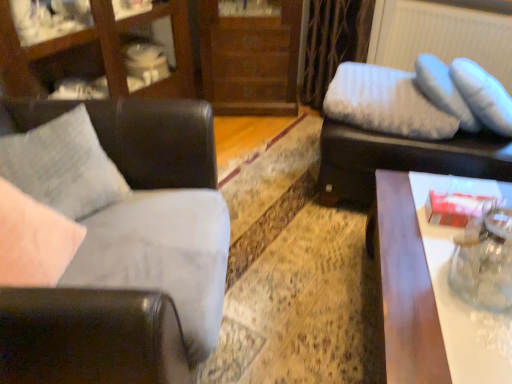
Measure the distance between textured gray pillow at left, the first pillow positioned from the left, and camera.

textured gray pillow at left, the first pillow positioned from the left, and camera are 4.03 feet apart.

Locate an element on the screen. Image resolution: width=512 pixels, height=384 pixels. textured gray pillow at left, the first pillow positioned from the left is located at coordinates (63, 166).

At what (x,y) coordinates should I click in order to perform the action: click on leather couch at left. Please return your answer as a coordinate pair (x, y). The width and height of the screenshot is (512, 384). Looking at the image, I should click on point(116,256).

Describe the element at coordinates (432, 292) in the screenshot. This screenshot has width=512, height=384. I see `white glossy table at right` at that location.

What do you see at coordinates (404, 158) in the screenshot? I see `matte black swivel chair at upper right` at bounding box center [404, 158].

The image size is (512, 384). What do you see at coordinates (250, 60) in the screenshot?
I see `wooden dresser at center` at bounding box center [250, 60].

Where is `white fabric radiator at upper right`? This screenshot has width=512, height=384. white fabric radiator at upper right is located at coordinates (442, 36).

Locate an element on the screen. matte wood entertainment center at upper left is located at coordinates (101, 51).

Identify the location of textured gray pillow at left, marked as the 1th pillow in a front-to-back arrangement. (63, 166).

Which is in front, matte black swivel chair at upper right or white fluffy pillow at upper right, which ranks as the 2th pillow in front-to-back order?

Positioned in front is matte black swivel chair at upper right.

From a real-world perspective, which object stands above the other?

In real-world perspective, white fluffy pillow at upper right, arranged as the first pillow when viewed from the right, is above.

From the image's perspective, between matte black swivel chair at upper right and white fluffy pillow at upper right, the second pillow when ordered from left to right, which one is located above?

white fluffy pillow at upper right, the second pillow when ordered from left to right.

Based on the photo, how far apart are matte black swivel chair at upper right and white fluffy pillow at upper right, arranged as the first pillow when viewed from the right?

matte black swivel chair at upper right is 4.41 inches away from white fluffy pillow at upper right, arranged as the first pillow when viewed from the right.

Is textured gray pillow at left, which is the 2th pillow in right-to-left order, with white fluffy pillow at upper right, marked as the 1th pillow in a back-to-front arrangement?

textured gray pillow at left, which is the 2th pillow in right-to-left order, and white fluffy pillow at upper right, marked as the 1th pillow in a back-to-front arrangement, are clearly separated.

Can you confirm if textured gray pillow at left, the first pillow positioned from the left, is shorter than white fluffy pillow at upper right, the second pillow when ordered from left to right?

No.

Which point is more distant from viewer, (x=115, y=186) or (x=381, y=128)?

Point (x=381, y=128)

Is textured gray pillow at left, acting as the 2th pillow starting from the back, at the left side of white fluffy pillow at upper right, which ranks as the 2th pillow in front-to-back order?

Yes, textured gray pillow at left, acting as the 2th pillow starting from the back, is to the left of white fluffy pillow at upper right, which ranks as the 2th pillow in front-to-back order.

Does white fabric radiator at upper right appear on the left side of white fluffy pillow at upper right, the second pillow when ordered from left to right?

No.

From a real-world perspective, is white fabric radiator at upper right above or below white fluffy pillow at upper right, marked as the 1th pillow in a back-to-front arrangement?

From a real-world perspective, white fabric radiator at upper right is physically above white fluffy pillow at upper right, marked as the 1th pillow in a back-to-front arrangement.

Could you tell me if white fabric radiator at upper right is facing white fluffy pillow at upper right, which ranks as the 2th pillow in front-to-back order?

Yes, white fabric radiator at upper right is turned towards white fluffy pillow at upper right, which ranks as the 2th pillow in front-to-back order.

Is white fabric radiator at upper right positioned far away from white fluffy pillow at upper right, marked as the 1th pillow in a back-to-front arrangement?

No, there isn't a large distance between white fabric radiator at upper right and white fluffy pillow at upper right, marked as the 1th pillow in a back-to-front arrangement.

Are matte black swivel chair at upper right and wooden dresser at center far apart?

Yes, matte black swivel chair at upper right is far from wooden dresser at center.

Identify the location of dresser lying behind the matte black swivel chair at upper right. The image size is (512, 384). click(x=250, y=60).

From a real-world perspective, which is physically below, matte black swivel chair at upper right or wooden dresser at center?

matte black swivel chair at upper right is physically lower.

From the image's perspective, is white fluffy pillow at upper right, marked as the 1th pillow in a back-to-front arrangement, located above or below matte black swivel chair at upper right?

Based on their image positions, white fluffy pillow at upper right, marked as the 1th pillow in a back-to-front arrangement, is located above matte black swivel chair at upper right.

Would you say white fluffy pillow at upper right, marked as the 1th pillow in a back-to-front arrangement, is outside matte black swivel chair at upper right?

Absolutely, white fluffy pillow at upper right, marked as the 1th pillow in a back-to-front arrangement, is external to matte black swivel chair at upper right.

Who is smaller, white fluffy pillow at upper right, which ranks as the 2th pillow in front-to-back order, or matte black swivel chair at upper right?

With smaller size is white fluffy pillow at upper right, which ranks as the 2th pillow in front-to-back order.

Is leather couch at left surrounded by textured gray pillow at left, acting as the 2th pillow starting from the back?

No, leather couch at left is not inside textured gray pillow at left, acting as the 2th pillow starting from the back.

Is textured gray pillow at left, acting as the 2th pillow starting from the back, at the right side of leather couch at left?

Correct, you'll find textured gray pillow at left, acting as the 2th pillow starting from the back, to the right of leather couch at left.

Which object is wider, textured gray pillow at left, the first pillow positioned from the left, or leather couch at left?

Wider between the two is leather couch at left.

Is textured gray pillow at left, which is the 2th pillow in right-to-left order, bigger than leather couch at left?

No, textured gray pillow at left, which is the 2th pillow in right-to-left order, is not bigger than leather couch at left.

Is white fluffy pillow at upper right, arranged as the first pillow when viewed from the right, with matte wood entertainment center at upper left?

There is a gap between white fluffy pillow at upper right, arranged as the first pillow when viewed from the right, and matte wood entertainment center at upper left.

Is white fluffy pillow at upper right, marked as the 1th pillow in a back-to-front arrangement, facing towards matte wood entertainment center at upper left?

No, white fluffy pillow at upper right, marked as the 1th pillow in a back-to-front arrangement, is not aimed at matte wood entertainment center at upper left.

This screenshot has height=384, width=512. In order to click on the 2nd pillow to the right of the matte wood entertainment center at upper left, counting from the anchor's position in this screenshot , I will do `click(385, 103)`.

Is point (348, 79) closer or farther from the camera than point (161, 15)?

Point (348, 79) is closer to the camera than point (161, 15).

Locate an element on the screen. pillow that is the 1st one above the matte black swivel chair at upper right (from a real-world perspective) is located at coordinates (385, 103).

Identify the location of pillow on the right of the textured gray pillow at left, marked as the 1th pillow in a front-to-back arrangement. This screenshot has height=384, width=512. (385, 103).

Looking at the image, which one is located closer to white fluffy pillow at upper right, arranged as the first pillow when viewed from the right, matte wood entertainment center at upper left or textured gray pillow at left, which is the 2th pillow in right-to-left order?

Among the two, textured gray pillow at left, which is the 2th pillow in right-to-left order, is located nearer to white fluffy pillow at upper right, arranged as the first pillow when viewed from the right.

Estimate the real-world distances between objects in this image. Which object is closer to textured gray pillow at left, acting as the 2th pillow starting from the back, matte wood entertainment center at upper left or white glossy table at right?

matte wood entertainment center at upper left is positioned closer to the anchor textured gray pillow at left, acting as the 2th pillow starting from the back.

Estimate the real-world distances between objects in this image. Which object is further from white fluffy pillow at upper right, marked as the 1th pillow in a back-to-front arrangement, white fabric radiator at upper right or leather couch at left?

leather couch at left is further to white fluffy pillow at upper right, marked as the 1th pillow in a back-to-front arrangement.

When comparing their distances from leather couch at left, does matte black swivel chair at upper right or wooden dresser at center seem closer?

The object closer to leather couch at left is matte black swivel chair at upper right.

From the image, which object appears to be nearer to matte black swivel chair at upper right, matte wood entertainment center at upper left or textured gray pillow at left, which is the 2th pillow in right-to-left order?

textured gray pillow at left, which is the 2th pillow in right-to-left order, is positioned closer to the anchor matte black swivel chair at upper right.

Consider the image. Estimate the real-world distances between objects in this image. Which object is closer to white fluffy pillow at upper right, marked as the 1th pillow in a back-to-front arrangement, wooden dresser at center or white fabric radiator at upper right?

The object closer to white fluffy pillow at upper right, marked as the 1th pillow in a back-to-front arrangement, is white fabric radiator at upper right.

Looking at the image, which one is located closer to wooden dresser at center, matte wood entertainment center at upper left or textured gray pillow at left, which is the 2th pillow in right-to-left order?

matte wood entertainment center at upper left lies closer to wooden dresser at center than the other object.

Considering their positions, is white fluffy pillow at upper right, which ranks as the 2th pillow in front-to-back order, positioned further to white glossy table at right than matte wood entertainment center at upper left?

matte wood entertainment center at upper left lies further to white glossy table at right than the other object.

This screenshot has height=384, width=512. In order to click on dresser between textured gray pillow at left, acting as the 2th pillow starting from the back, and white fabric radiator at upper right from left to right in this screenshot , I will do `click(250, 60)`.

Where is `swivel chair positioned between white glossy table at right and wooden dresser at center from near to far`? This screenshot has width=512, height=384. swivel chair positioned between white glossy table at right and wooden dresser at center from near to far is located at coordinates (404, 158).

Identify the location of dresser between matte wood entertainment center at upper left and white glossy table at right in the horizontal direction. The width and height of the screenshot is (512, 384). (250, 60).

The width and height of the screenshot is (512, 384). Identify the location of table between textured gray pillow at left, acting as the 2th pillow starting from the back, and white fabric radiator at upper right from left to right. (432, 292).